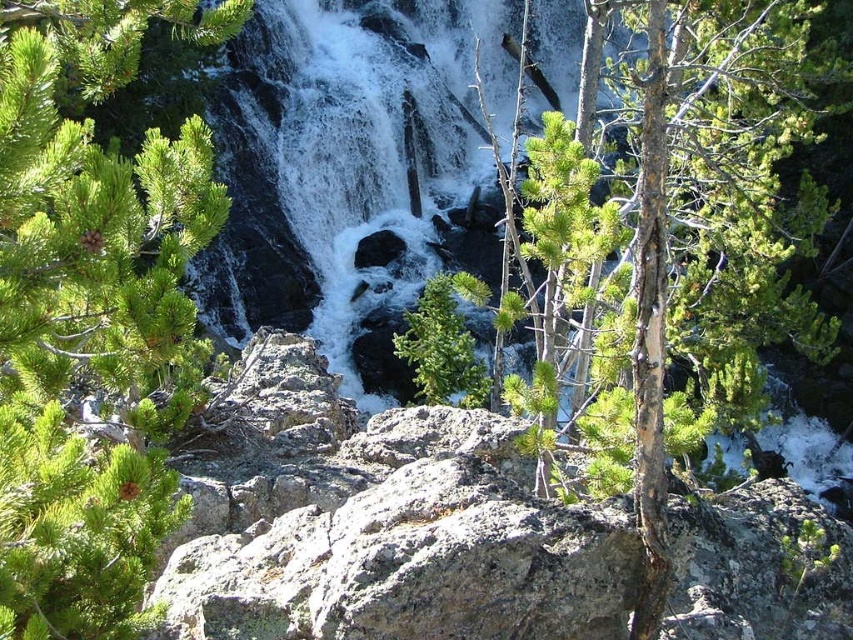
Question: Which is farther from the green needle-like at left?

Choices:
 (A) green rough bark tree at center
 (B) white frothy water at center

Answer: (B)

Question: Is green rough bark tree at center wider than white frothy water at center?

Choices:
 (A) no
 (B) yes

Answer: (A)

Question: Which object is positioned closest to the green rough bark tree at center?

Choices:
 (A) white frothy water at center
 (B) green needle-like at left

Answer: (B)

Question: Does green rough bark tree at center appear on the right side of white frothy water at center?

Choices:
 (A) yes
 (B) no

Answer: (A)

Question: Is green needle-like at left above white frothy water at center?

Choices:
 (A) no
 (B) yes

Answer: (A)

Question: Which point is closer to the camera?

Choices:
 (A) green rough bark tree at center
 (B) white frothy water at center
 (C) green needle-like at left

Answer: (C)